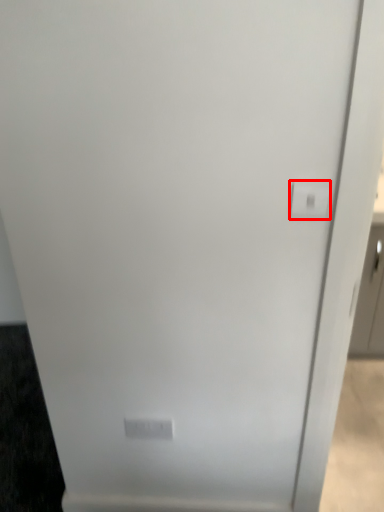
Question: From the image's perspective, where is light switch (annotated by the red box) located in relation to light switch in the image?

Choices:
 (A) below
 (B) above

Answer: (B)